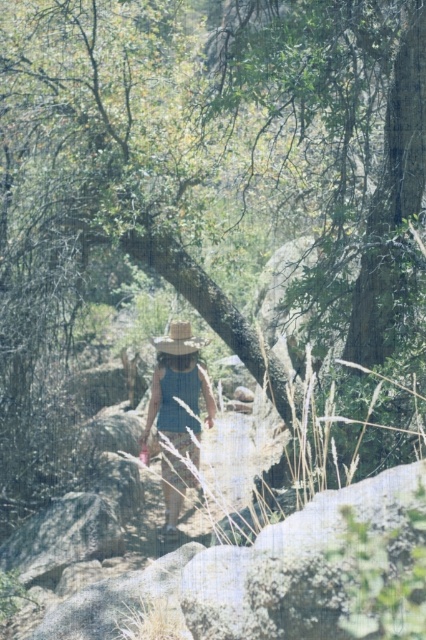
Question: Which point is closer to the camera?

Choices:
 (A) blue denim dress at center
 (B) light brown straw cowboy hat at center

Answer: (A)

Question: Can you confirm if blue denim dress at center is positioned to the right of light brown straw cowboy hat at center?

Choices:
 (A) yes
 (B) no

Answer: (B)

Question: Does blue denim dress at center have a lesser width compared to light brown straw cowboy hat at center?

Choices:
 (A) no
 (B) yes

Answer: (A)

Question: Which of the following is the closest to the observer?

Choices:
 (A) light brown straw cowboy hat at center
 (B) blue denim dress at center

Answer: (B)

Question: Is blue denim dress at center bigger than light brown straw cowboy hat at center?

Choices:
 (A) yes
 (B) no

Answer: (A)